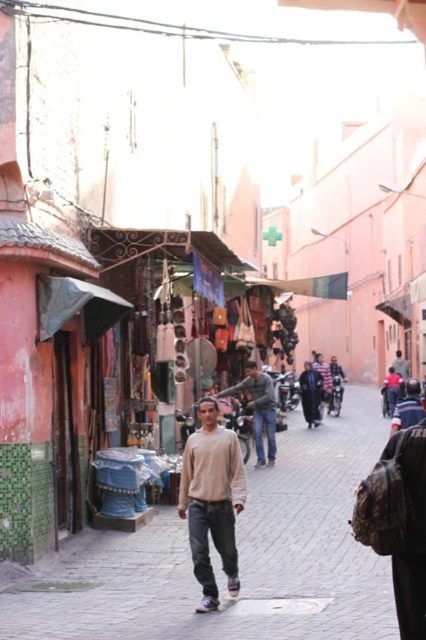
Question: Does matte beige man at center appear on the right side of beige cotton sweater at center?

Choices:
 (A) no
 (B) yes

Answer: (B)

Question: Which point is closer to the camera taking this photo?

Choices:
 (A) (400, 410)
 (B) (233, 516)

Answer: (B)

Question: Can you confirm if matte beige man at center is smaller than light brown leather jacket at center?

Choices:
 (A) no
 (B) yes

Answer: (A)

Question: Is matte beige man at center above dark blue fabric at center?

Choices:
 (A) yes
 (B) no

Answer: (B)

Question: Based on their relative distances, which object is nearer to the dark blue fabric at center?

Choices:
 (A) matte beige man at center
 (B) light brown sweater at center

Answer: (B)

Question: Based on their relative distances, which object is farther from the beige cotton sweater at center?

Choices:
 (A) light brown leather jacket at center
 (B) light brown sweater at center
 (C) dark blue fabric at center

Answer: (C)